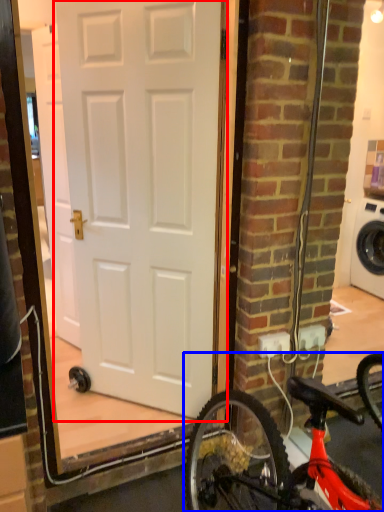
Question: Which point is closer to the camera, door (highlighted by a red box) or bicycle (highlighted by a blue box)?

Choices:
 (A) door
 (B) bicycle

Answer: (B)